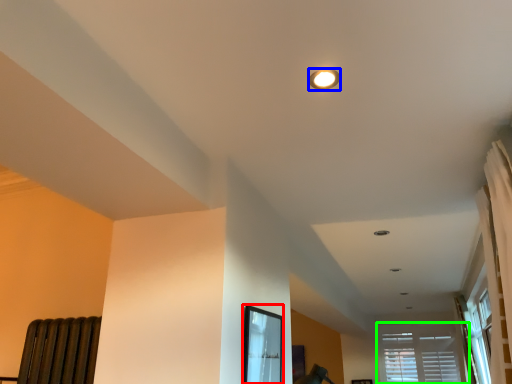
Question: Considering the real-world distances, which object is closest to bay window (highlighted by a red box)? lighting (highlighted by a blue box) or window (highlighted by a green box).

Choices:
 (A) lighting
 (B) window

Answer: (A)